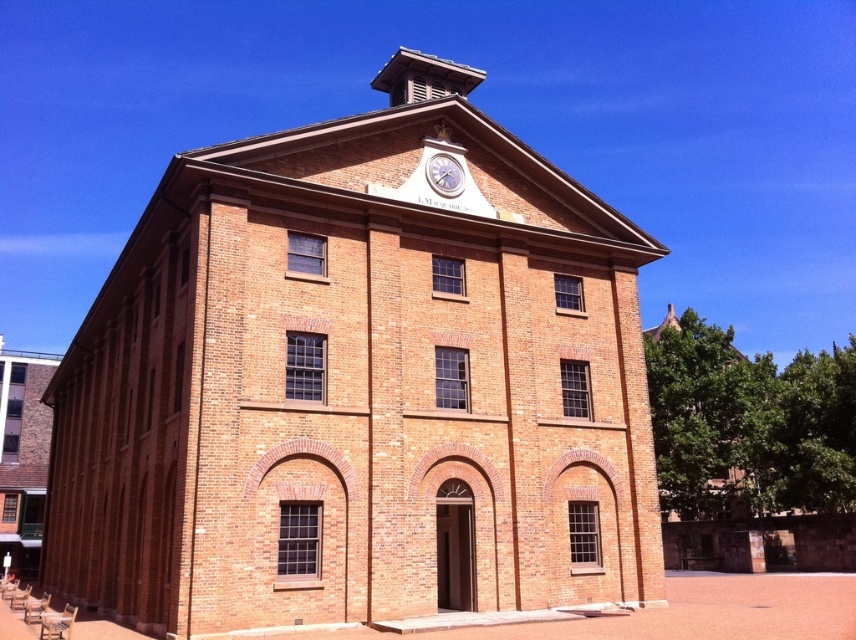
Between brown brick building at center and metallic silver clock at center, which one appears on the left side from the viewer's perspective?

From the viewer's perspective, brown brick building at center appears more on the left side.

Can you confirm if brown brick building at center is bigger than metallic silver clock at center?

Correct, brown brick building at center is larger in size than metallic silver clock at center.

Locate an element on the screen. The image size is (856, 640). brown brick building at center is located at coordinates (358, 384).